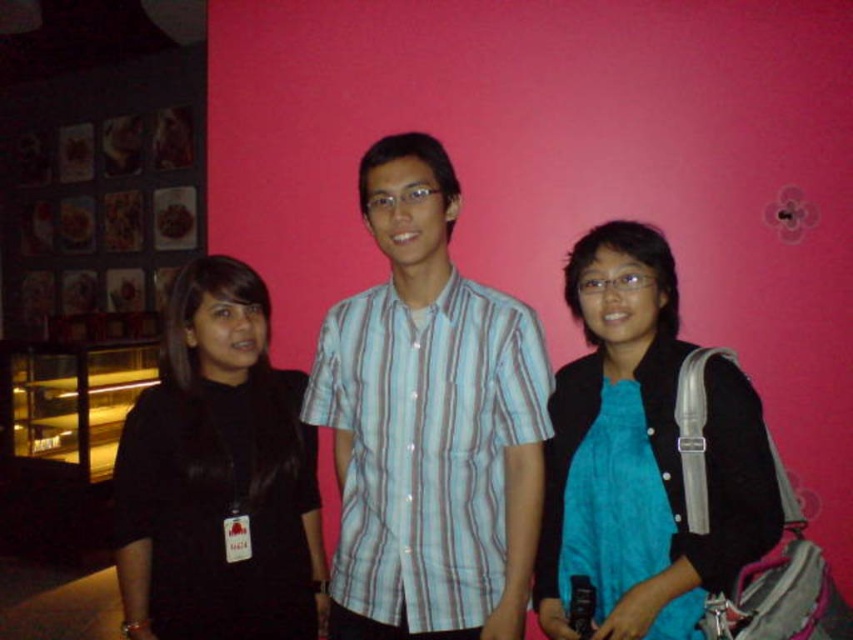
Does light blue striped shirt at center appear over blue fabric scarf at center?

Yes.

Image resolution: width=853 pixels, height=640 pixels. What are the coordinates of `light blue striped shirt at center` in the screenshot? It's located at (428, 422).

Who is more forward, (347, 448) or (729, 456)?

Point (729, 456)

Locate an element on the screen. The width and height of the screenshot is (853, 640). light blue striped shirt at center is located at coordinates (428, 422).

Is light blue striped shirt at center wider than black matte shirt at left?

Correct, the width of light blue striped shirt at center exceeds that of black matte shirt at left.

Which is above, light blue striped shirt at center or black matte shirt at left?

light blue striped shirt at center

The width and height of the screenshot is (853, 640). What do you see at coordinates (428, 422) in the screenshot? I see `light blue striped shirt at center` at bounding box center [428, 422].

You are a GUI agent. You are given a task and a screenshot of the screen. Output one action in this format:
    pyautogui.click(x=<x>, y=<y>)
    Task: Click on the light blue striped shirt at center
    The height and width of the screenshot is (640, 853).
    Given the screenshot: What is the action you would take?
    pyautogui.click(x=428, y=422)

Is point (599, 621) in front of point (207, 371)?

Yes.

Who is taller, blue fabric scarf at center or black matte shirt at left?

black matte shirt at left

Where is `blue fabric scarf at center`? The image size is (853, 640). blue fabric scarf at center is located at coordinates (642, 452).